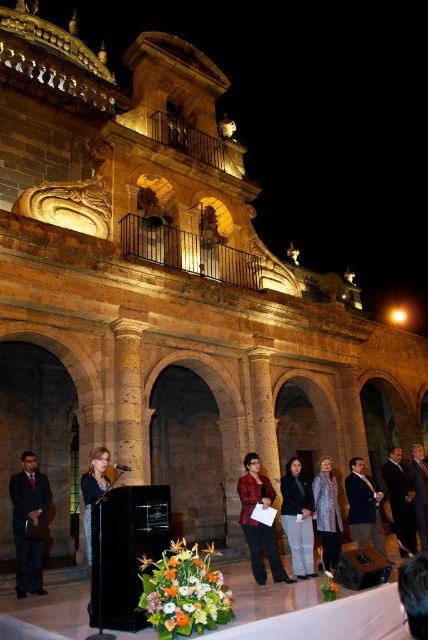
You are a GUI agent. You are given a task and a screenshot of the screen. Output one action in this format:
    pyautogui.click(x=<x>, y=<y>)
    Task: Click on the matte black jacket at center
    This screenshot has width=428, height=640.
    Given the screenshot: What is the action you would take?
    pyautogui.click(x=297, y=518)

Is matte black jacket at center bigger than shiny metallic coat at center?

Indeed, matte black jacket at center has a larger size compared to shiny metallic coat at center.

Which is behind, point (309, 502) or point (315, 483)?

Positioned behind is point (315, 483).

Where is `matte black jacket at center`? matte black jacket at center is located at coordinates (297, 518).

Is dark suit at left above dark blue suit at center?

Yes, dark suit at left is above dark blue suit at center.

Where is `dark suit at left`? This screenshot has height=640, width=428. dark suit at left is located at coordinates (29, 524).

Which is below, shiny metallic coat at center or matte black dress at center?

Positioned lower is shiny metallic coat at center.

Who is higher up, shiny metallic coat at center or matte black dress at center?

matte black dress at center

Find the location of `shiny metallic coat at center`. shiny metallic coat at center is located at coordinates (326, 515).